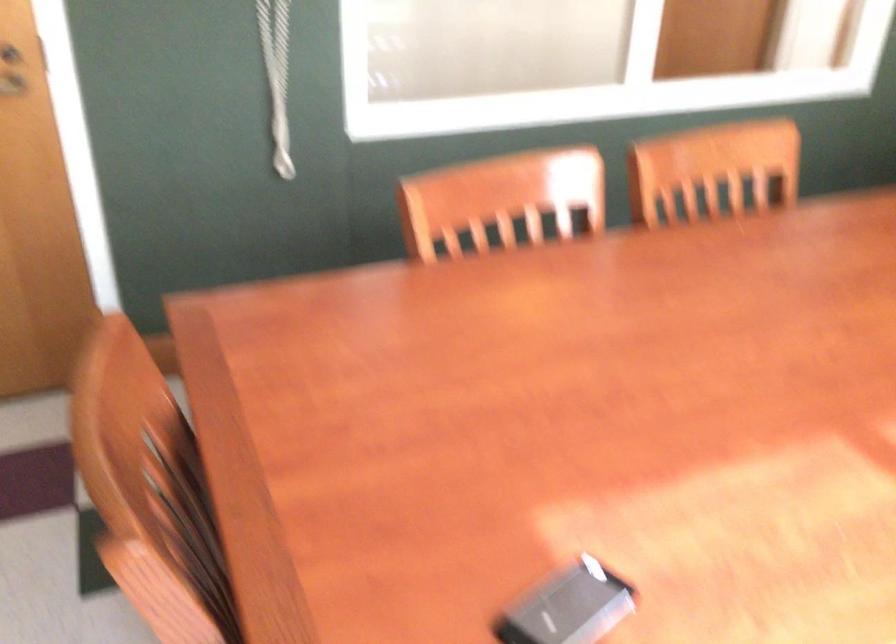
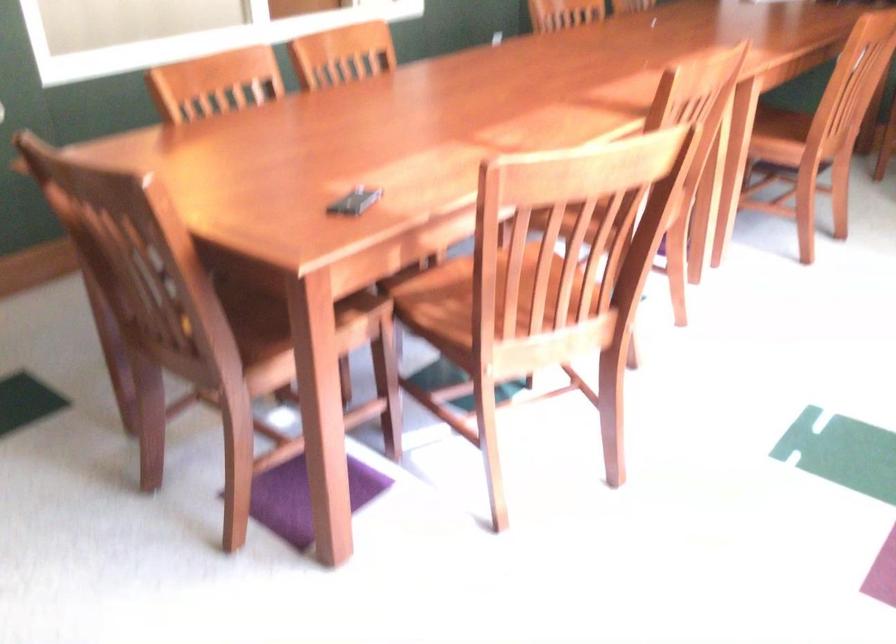
Question: The camera is either moving clockwise (left) or counter-clockwise (right) around the object. The first image is from the beginning of the video and the second image is from the end. Is the camera moving left or right when shooting the video?

Choices:
 (A) Left
 (B) Right

Answer: (A)